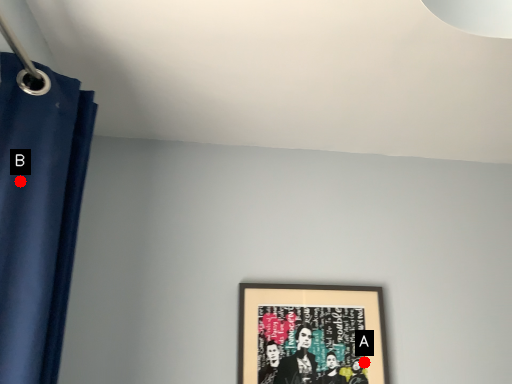
Question: Two points are circled on the image, labeled by A and B beside each circle. Among these points, which one is nearest to the camera?

Choices:
 (A) A is closer
 (B) B is closer

Answer: (B)